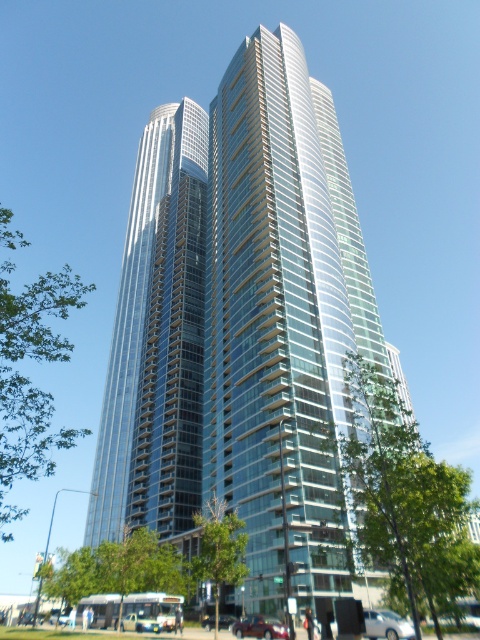
Question: Can you confirm if glassy silver skyscraper at center is thinner than green leafy tree at center?

Choices:
 (A) no
 (B) yes

Answer: (A)

Question: Which object appears farthest from the camera in this image?

Choices:
 (A) metallic silver sedan at center
 (B) glassy metallic skyscraper at center
 (C) metallic silver sedan at lower center

Answer: (A)

Question: Which point is closer to the camera?

Choices:
 (A) (384, 612)
 (B) (272, 593)
 (C) (136, 566)
 (D) (133, 627)

Answer: (A)

Question: Does green leafy tree at lower center have a smaller size compared to metallic silver sedan at center?

Choices:
 (A) no
 (B) yes

Answer: (A)

Question: Can you confirm if green leafy tree at center is bigger than white glossy sedan at lower right?

Choices:
 (A) no
 (B) yes

Answer: (B)

Question: Which point appears farthest from the camera in this image?

Choices:
 (A) (140, 625)
 (B) (33, 444)

Answer: (A)